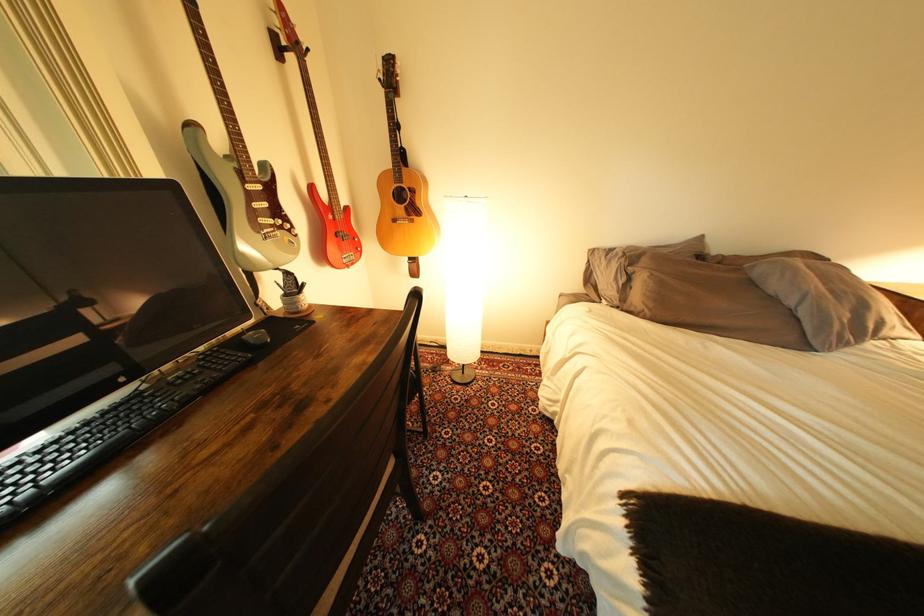
Describe the element at coordinates (238, 176) in the screenshot. I see `a brown acoustic guitar` at that location.